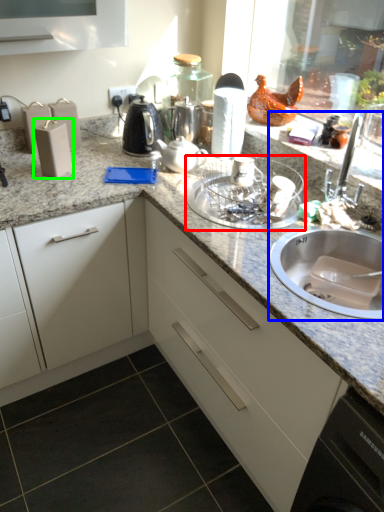
Question: Based on their relative distances, which object is farther from glass bowl (highlighted by a red box)? Choose from sink (highlighted by a blue box) and appliance (highlighted by a green box).

Choices:
 (A) sink
 (B) appliance

Answer: (B)